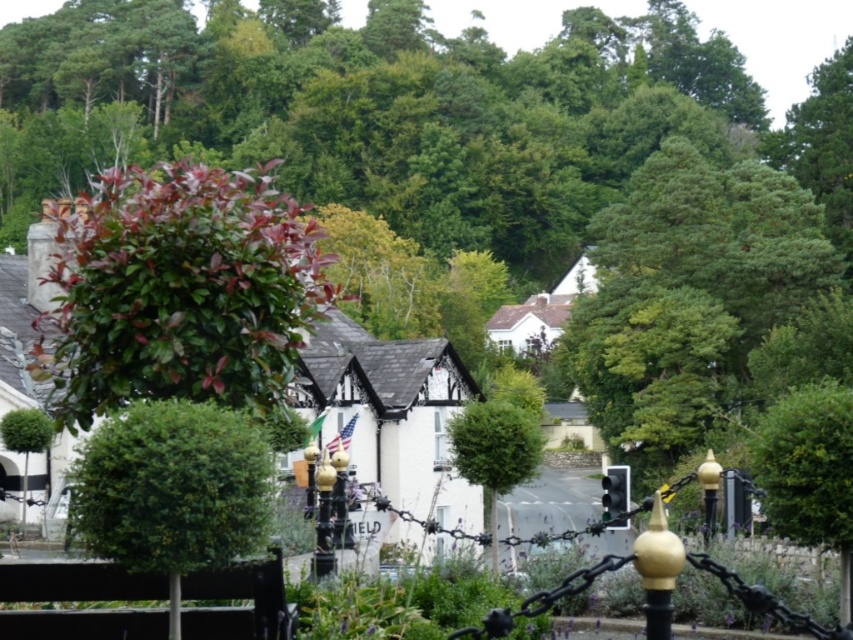
Which is behind, point (90, 273) or point (38, 419)?

The point (38, 419) is behind.

Between green glossy tree at upper left and green glossy tree at left, which one has more height?

green glossy tree at upper left

In order to click on green glossy tree at upper left in this screenshot , I will do `click(178, 291)`.

How distant is green leafy bush at center from green glossy tree at left?

19.54 meters

Is point (494, 410) positioned before point (26, 424)?

Yes.

Which is in front, point (459, 460) or point (51, 433)?

Point (459, 460)

Locate an element on the screen. This screenshot has height=640, width=853. green leafy bush at center is located at coordinates (494, 452).

Is green glossy tree at upper left shorter than green leafy bush at center?

No, green glossy tree at upper left is not shorter than green leafy bush at center.

Which is more to the right, green glossy tree at upper left or green leafy bush at center?

green leafy bush at center

Between point (190, 253) and point (485, 500), which one is positioned behind?

The point (485, 500) is behind.

Where is `green glossy tree at upper left`? This screenshot has height=640, width=853. green glossy tree at upper left is located at coordinates (178, 291).